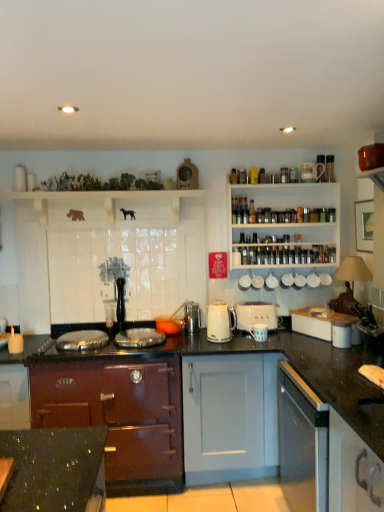
In order to face white plastic toaster at center-right, marked as the 3th appliance in a right-to-left arrangement, should I rotate leftwards or rightwards?

A 8.865 degree turn to the right will do.

At what (x,y) coordinates should I click in order to perform the action: click on white ceramic mug at center, arranged as the fourth appliance when viewed from the right. Please return your answer as a coordinate pair (x, y). The height and width of the screenshot is (512, 384). Looking at the image, I should click on (259, 332).

You are a GUI agent. You are given a task and a screenshot of the screen. Output one action in this format:
    pyautogui.click(x=<x>, y=<y>)
    Task: Click on the clear glass spice jars at upper right
    The width and height of the screenshot is (384, 512).
    Given the screenshot: What is the action you would take?
    pyautogui.click(x=286, y=224)

Image resolution: width=384 pixels, height=512 pixels. What do you see at coordinates (192, 317) in the screenshot?
I see `metallic silver toaster at center, which is counted as the second appliance, starting from the left` at bounding box center [192, 317].

What are the coordinates of `white plastic toaster at center-right, acting as the 4th appliance starting from the left` in the screenshot? It's located at (256, 315).

In the scene shown: Can you confirm if white plastic toaster at center-right, marked as the 3th appliance in a right-to-left arrangement, is shorter than white ceramic mug at center, positioned as the third appliance in left-to-right order?

No, white plastic toaster at center-right, marked as the 3th appliance in a right-to-left arrangement, is not shorter than white ceramic mug at center, positioned as the third appliance in left-to-right order.

Is white plastic toaster at center-right, acting as the 4th appliance starting from the left, oriented away from white ceramic mug at center, arranged as the fourth appliance when viewed from the right?

white plastic toaster at center-right, acting as the 4th appliance starting from the left, does not have its back to white ceramic mug at center, arranged as the fourth appliance when viewed from the right.

From the image's perspective, is white plastic toaster at center-right, acting as the 4th appliance starting from the left, over white ceramic mug at center, positioned as the third appliance in left-to-right order?

Yes, from the image's perspective, white plastic toaster at center-right, acting as the 4th appliance starting from the left, is above white ceramic mug at center, positioned as the third appliance in left-to-right order.

Would you say white plastic toaster at center-right, acting as the 4th appliance starting from the left, is outside white ceramic mug at center, positioned as the third appliance in left-to-right order?

Absolutely, white plastic toaster at center-right, acting as the 4th appliance starting from the left, is external to white ceramic mug at center, positioned as the third appliance in left-to-right order.

Between white glossy cup at upper right, acting as the 6th appliance starting from the left, and white ceramic mugs at upper center, the fifth appliance from the left, which one appears on the left side from the viewer's perspective?

white ceramic mugs at upper center, the fifth appliance from the left, is more to the left.

Could you tell me if white glossy cup at upper right, which appears as the 1th appliance when viewed from the right, is turned towards white ceramic mugs at upper center, the fifth appliance from the left?

No, white glossy cup at upper right, which appears as the 1th appliance when viewed from the right, does not turn towards white ceramic mugs at upper center, the fifth appliance from the left.

Considering the relative sizes of white glossy cup at upper right, acting as the 6th appliance starting from the left, and white ceramic mugs at upper center, placed as the second appliance when sorted from right to left, in the image provided, is white glossy cup at upper right, acting as the 6th appliance starting from the left, thinner than white ceramic mugs at upper center, placed as the second appliance when sorted from right to left,?

Incorrect, the width of white glossy cup at upper right, acting as the 6th appliance starting from the left, is not less than that of white ceramic mugs at upper center, placed as the second appliance when sorted from right to left.

Is point (310, 283) less distant than point (272, 273)?

No.

Is white matte cabinet at right, the first cabinetry when ordered from top to bottom, directly adjacent to white ceramic mug at center, arranged as the fourth appliance when viewed from the right?

white matte cabinet at right, the first cabinetry when ordered from top to bottom, and white ceramic mug at center, arranged as the fourth appliance when viewed from the right, are clearly separated.

Which is in front, point (305, 321) or point (257, 324)?

The point (257, 324) is in front.

How much distance is there between white matte cabinet at right, arranged as the 1th cabinetry when viewed from the right, and white ceramic mug at center, positioned as the third appliance in left-to-right order?

white matte cabinet at right, arranged as the 1th cabinetry when viewed from the right, is 13.85 inches away from white ceramic mug at center, positioned as the third appliance in left-to-right order.

From the image's perspective, relative to white ceramic mug at center, arranged as the fourth appliance when viewed from the right, is white matte cabinet at right, arranged as the 1th cabinetry when viewed from the right, above or below?

Clearly, from the image's perspective, white matte cabinet at right, arranged as the 1th cabinetry when viewed from the right, is above white ceramic mug at center, arranged as the fourth appliance when viewed from the right.

From the image's perspective, is clear glass spice jars at upper right located above or below white plastic toaster at center-right, marked as the 3th appliance in a right-to-left arrangement?

clear glass spice jars at upper right is above white plastic toaster at center-right, marked as the 3th appliance in a right-to-left arrangement.

Which point is more forward, (262,220) or (260,315)?

The point (260,315) is closer to the camera.

Which of these two, clear glass spice jars at upper right or white plastic toaster at center-right, acting as the 4th appliance starting from the left, is bigger?

Bigger between the two is clear glass spice jars at upper right.

Considering the positions of objects clear glass spice jars at upper right and white plastic toaster at center-right, marked as the 3th appliance in a right-to-left arrangement, in the image provided, who is in front, clear glass spice jars at upper right or white plastic toaster at center-right, marked as the 3th appliance in a right-to-left arrangement,?

white plastic toaster at center-right, marked as the 3th appliance in a right-to-left arrangement.

From a real-world perspective, which appliance is the 3rd one underneath the metallic silver toaster at center, which is the fifth appliance from right to left? Please provide its 2D coordinates.

[(259, 332)]

Is white ceramic mug at center, positioned as the third appliance in left-to-right order, bigger or smaller than metallic silver toaster at center, which is the fifth appliance from right to left?

In the image, white ceramic mug at center, positioned as the third appliance in left-to-right order, appears to be smaller than metallic silver toaster at center, which is the fifth appliance from right to left.

Is white ceramic mug at center, arranged as the fourth appliance when viewed from the right, looking in the opposite direction of metallic silver toaster at center, which is the fifth appliance from right to left?

No, metallic silver toaster at center, which is the fifth appliance from right to left, is not at the back of white ceramic mug at center, arranged as the fourth appliance when viewed from the right.

Is white ceramic mug at center, positioned as the third appliance in left-to-right order, not close to metallic silver toaster at center, which is counted as the second appliance, starting from the left?

white ceramic mug at center, positioned as the third appliance in left-to-right order, is near metallic silver toaster at center, which is counted as the second appliance, starting from the left, not far away.

How many degrees apart are the facing directions of white glossy cup at upper right, which appears as the 1th appliance when viewed from the right, and white matte cabinet at right, which is the 2th cabinetry in bottom-to-top order?

The angular difference between white glossy cup at upper right, which appears as the 1th appliance when viewed from the right, and white matte cabinet at right, which is the 2th cabinetry in bottom-to-top order, is 57.9 degrees.

Looking at this image, relative to white matte cabinet at right, the first cabinetry when ordered from top to bottom, is white glossy cup at upper right, acting as the 6th appliance starting from the left, in front or behind?

Clearly, white glossy cup at upper right, acting as the 6th appliance starting from the left, is behind white matte cabinet at right, the first cabinetry when ordered from top to bottom.

Could you tell me if white glossy cup at upper right, which appears as the 1th appliance when viewed from the right, is facing white matte cabinet at right, arranged as the 1th cabinetry when viewed from the right?

No.

Is point (310, 279) closer or farther from the camera than point (323, 339)?

Point (310, 279) is farther from the camera than point (323, 339).

From a real-world perspective, is metallic silver toaster at center, which is the fifth appliance from right to left, physically located above or below maroon wood stove at center, marked as the first cabinetry in a bottom-to-top arrangement?

From a real-world perspective, metallic silver toaster at center, which is the fifth appliance from right to left, is physically above maroon wood stove at center, marked as the first cabinetry in a bottom-to-top arrangement.

Can you confirm if metallic silver toaster at center, which is counted as the second appliance, starting from the left, is positioned to the right of maroon wood stove at center, the 2th cabinetry from the top?

Correct, you'll find metallic silver toaster at center, which is counted as the second appliance, starting from the left, to the right of maroon wood stove at center, the 2th cabinetry from the top.

There is a maroon wood stove at center, arranged as the first cabinetry when viewed from the left. Where is `the 4th appliance above it (from the image's perspective)`? Image resolution: width=384 pixels, height=512 pixels. the 4th appliance above it (from the image's perspective) is located at coordinates (192, 317).

Is metallic silver toaster at center, which is counted as the second appliance, starting from the left, not close to maroon wood stove at center, the 2th cabinetry from the top?

That's not correct — metallic silver toaster at center, which is counted as the second appliance, starting from the left, is a little close to maroon wood stove at center, the 2th cabinetry from the top.

There is a white plastic toaster at center-right, marked as the 3th appliance in a right-to-left arrangement. Where is `the 2nd appliance below it (from a real-world perspective)`? the 2nd appliance below it (from a real-world perspective) is located at coordinates (259, 332).

Where is `appliance above the white ceramic mugs at upper center, placed as the second appliance when sorted from right to left (from the image's perspective)`? appliance above the white ceramic mugs at upper center, placed as the second appliance when sorted from right to left (from the image's perspective) is located at coordinates (313, 280).

Looking at this image, considering their positions, is white glossy electric kettle at center positioned further to metallic silver toaster at center, which is the fifth appliance from right to left, than white ceramic mugs at upper center, the fifth appliance from the left?

The object further to metallic silver toaster at center, which is the fifth appliance from right to left, is white ceramic mugs at upper center, the fifth appliance from the left.

Based on their spatial positions, is white ceramic mug at center, positioned as the third appliance in left-to-right order, or white matte cabinet at right, which is the 2th cabinetry in bottom-to-top order, closer to clear glass spice jars at upper right?

white matte cabinet at right, which is the 2th cabinetry in bottom-to-top order, is positioned closer to the anchor clear glass spice jars at upper right.

Which object lies nearer to the anchor point white glossy electric kettle at center, maroon wood stove at center, arranged as the first cabinetry when viewed from the left, or white plastic toaster at center-right, marked as the 3th appliance in a right-to-left arrangement?

Based on the image, white plastic toaster at center-right, marked as the 3th appliance in a right-to-left arrangement, appears to be nearer to white glossy electric kettle at center.

Looking at the image, which one is located closer to maroon wood stove at center, the 2th cabinetry from the top, white ceramic mugs at upper center, placed as the second appliance when sorted from right to left, or clear glass spice jars at upper right?

clear glass spice jars at upper right lies closer to maroon wood stove at center, the 2th cabinetry from the top, than the other object.

Consider the image. From the image, which object appears to be farther from metallic silver toaster at center, which is counted as the second appliance, starting from the left, white ceramic mug at center, arranged as the fourth appliance when viewed from the right, or white plastic toaster at center-right, marked as the 3th appliance in a right-to-left arrangement?

white ceramic mug at center, arranged as the fourth appliance when viewed from the right, lies further to metallic silver toaster at center, which is counted as the second appliance, starting from the left, than the other object.

Considering their positions, is white matte cabinet at right, which is the 2th cabinetry in bottom-to-top order, positioned closer to white plastic toaster at center-right, acting as the 4th appliance starting from the left, than maroon wood stove at center, marked as the first cabinetry in a bottom-to-top arrangement?

white matte cabinet at right, which is the 2th cabinetry in bottom-to-top order.

Considering their positions, is white ceramic mugs at upper center, the fifth appliance from the left, positioned closer to white glossy electric kettle at center than white matte cabinet at right, the first cabinetry when ordered from top to bottom?

white matte cabinet at right, the first cabinetry when ordered from top to bottom, lies closer to white glossy electric kettle at center than the other object.

Which object lies further to the anchor point white ceramic mugs at upper center, the fifth appliance from the left, white matte cabinet at right, which is the 2th cabinetry in bottom-to-top order, or white glossy electric kettle at center?

white glossy electric kettle at center is further to white ceramic mugs at upper center, the fifth appliance from the left.

The height and width of the screenshot is (512, 384). Find the location of `shelf between metallic silver toaster at center, which is the fifth appliance from right to left, and white glossy cup at upper right, acting as the 6th appliance starting from the left`. shelf between metallic silver toaster at center, which is the fifth appliance from right to left, and white glossy cup at upper right, acting as the 6th appliance starting from the left is located at coordinates (286, 224).

Locate an element on the screen. The height and width of the screenshot is (512, 384). kitchen appliance between orange glass bowl at center, which is the 1th appliance from left to right, and white matte cabinet at right, arranged as the 1th cabinetry when viewed from the right, in the horizontal direction is located at coordinates (220, 322).

Image resolution: width=384 pixels, height=512 pixels. In order to click on kitchen appliance situated between maroon wood stove at center, marked as the first cabinetry in a bottom-to-top arrangement, and white matte cabinet at right, arranged as the 1th cabinetry when viewed from the right, from left to right in this screenshot , I will do `click(220, 322)`.

At what (x,y) coordinates should I click in order to perform the action: click on kitchen appliance between orange glass bowl at center, placed as the 6th appliance when sorted from right to left, and white ceramic mugs at upper center, the fifth appliance from the left, from left to right. Please return your answer as a coordinate pair (x, y). The height and width of the screenshot is (512, 384). Looking at the image, I should click on point(220,322).